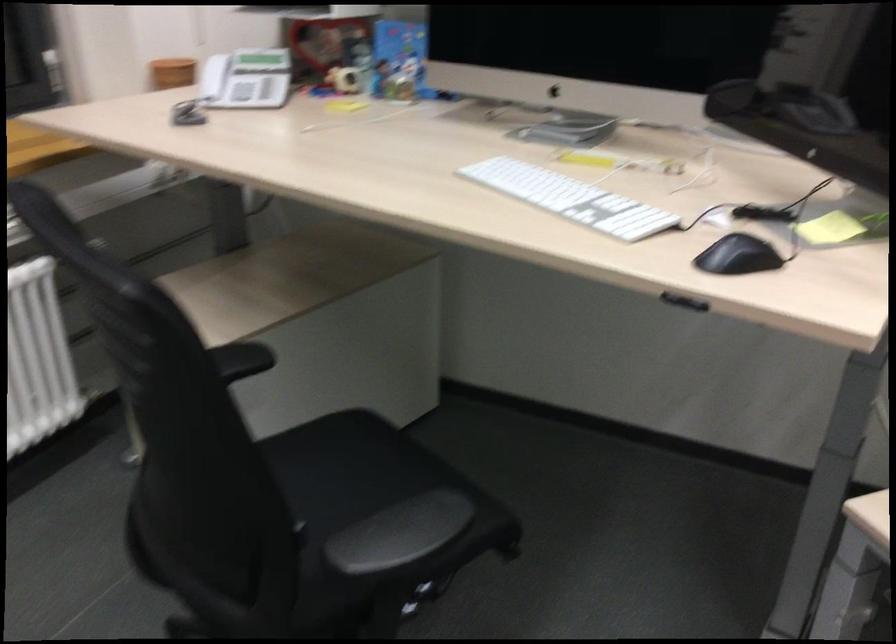
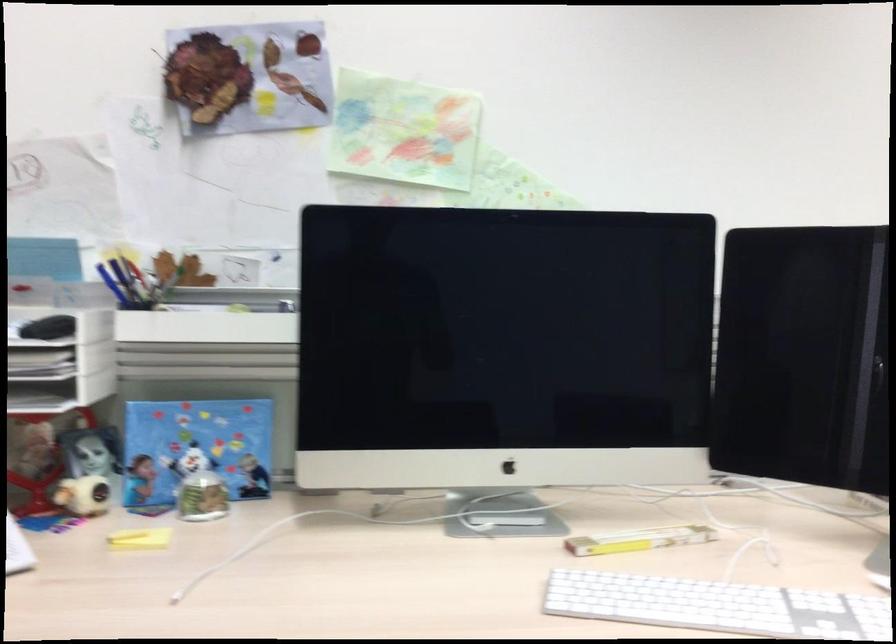
Find the pixel in the second image that matches point 562,192 in the first image.

(717, 605)